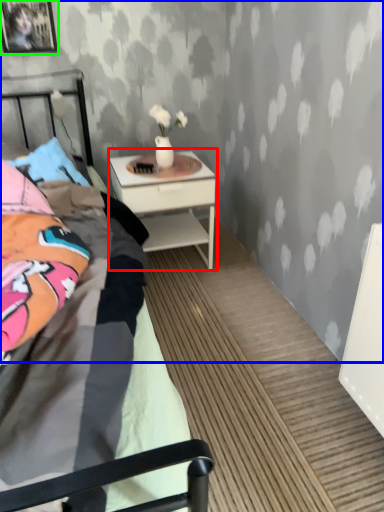
Question: Which is nearer to the nightstand (highlighted by a red box)? backdrop (highlighted by a blue box) or picture frame (highlighted by a green box).

Choices:
 (A) backdrop
 (B) picture frame

Answer: (A)